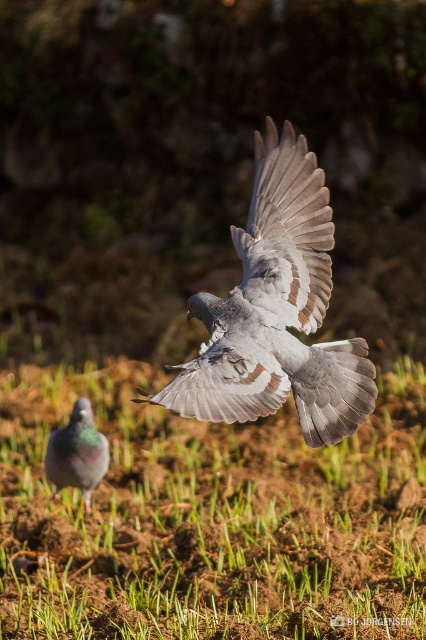
Based on the photo, you are a birdwatcher observing the scene. You notice the white feathered wing at center and the gray matte pigeon at lower left. Which object is closer to you?

The white feathered wing at center is closer to you because it is in front of the gray matte pigeon at lower left.

You are standing in the scene and want to place a small bird feeder. The feeder must be placed exactly where the green grass at lower center is located. What are the coordinates for placing the feeder?

The coordinates for placing the feeder are at point (212, 518).